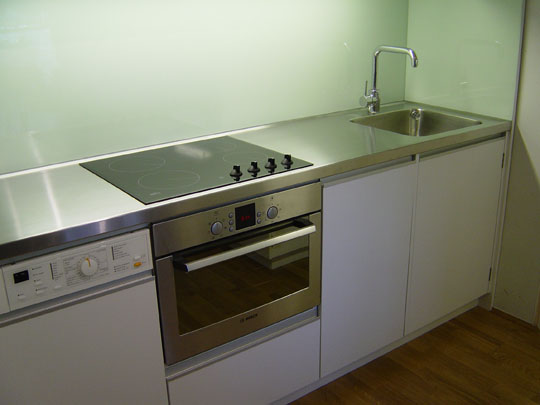
At what (x,y) coordinates should I click in order to perform the action: click on oven handle. Please return your answer as a coordinate pair (x, y). Looking at the image, I should click on (259, 243).